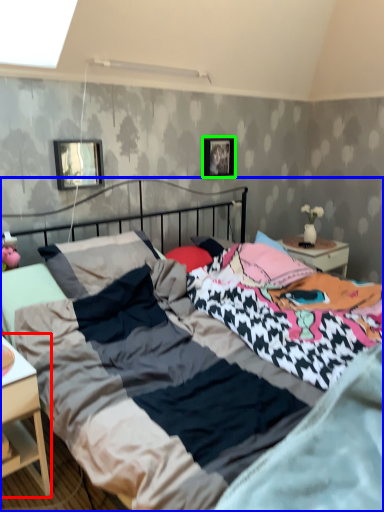
Question: Which object is the closest to the nightstand (highlighted by a red box)? Choose among these: bed (highlighted by a blue box) or picture frame (highlighted by a green box).

Choices:
 (A) bed
 (B) picture frame

Answer: (A)